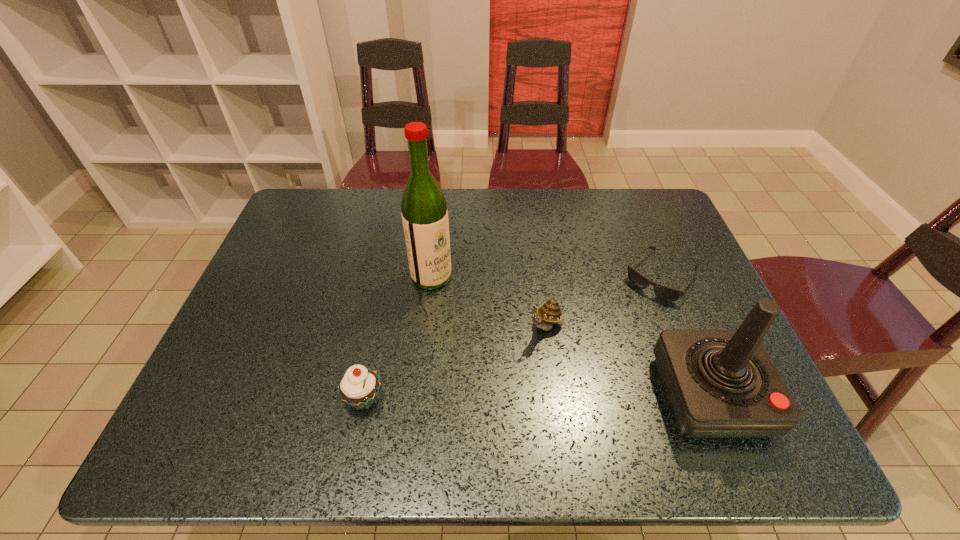
This screenshot has width=960, height=540. I want to click on object that is the third closest to the shortest object, so click(x=424, y=213).

This screenshot has width=960, height=540. I want to click on free space that satisfies the following two spatial constraints: 1. on the back side of the shortest object; 2. on the right side of the fourth object from right to left, so click(x=431, y=276).